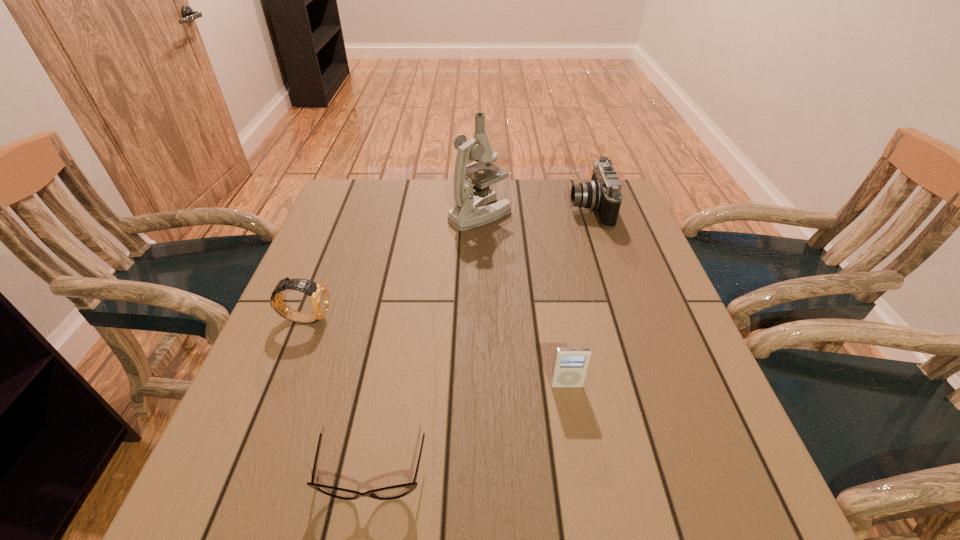
Identify the location of vacant region between the iPod and the second tallest object. Image resolution: width=960 pixels, height=540 pixels. (578, 297).

Identify the location of blank region between the shortest object and the camera. (481, 343).

Locate an element on the screen. empty space that is in between the leftmost object and the second tallest object is located at coordinates (447, 264).

I want to click on free space between the nearest object and the fourth farthest object, so click(469, 431).

You are a GUI agent. You are given a task and a screenshot of the screen. Output one action in this format:
    pyautogui.click(x=<x>, y=<y>)
    Task: Click on the free space between the camera and the tallest object
    The width and height of the screenshot is (960, 540).
    Given the screenshot: What is the action you would take?
    pyautogui.click(x=535, y=212)

You are a GUI agent. You are given a task and a screenshot of the screen. Output one action in this format:
    pyautogui.click(x=<x>, y=<y>)
    Task: Click on the empty space that is in between the second nearest object and the camera
    
    Given the screenshot: What is the action you would take?
    pyautogui.click(x=578, y=297)

Image resolution: width=960 pixels, height=540 pixels. I want to click on vacant space that's between the rightmost object and the tallest object, so click(x=535, y=212).

Find the location of a particular element. This screenshot has width=960, height=540. vacant space that's between the fourth farthest object and the rightmost object is located at coordinates (578, 297).

Identify which object is the fourth nearest to the camera. Please provide its 2D coordinates. Your answer should be formatted as a tuple, i.e. [(x, y)], where the tuple contains the x and y coordinates of a point satisfying the conditions above.

[(397, 491)]

Identify which object is the nearest to the third farthest object. Please provide its 2D coordinates. Your answer should be formatted as a tuple, i.e. [(x, y)], where the tuple contains the x and y coordinates of a point satisfying the conditions above.

[(397, 491)]